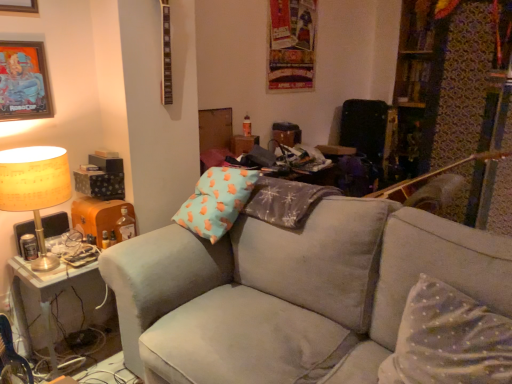
Question: From a real-world perspective, is metallic silver picture frame at upper left, which ranks as the second picture frame in top-to-bottom order, physically below white dotted fabric pillow at lower right?

Choices:
 (A) yes
 (B) no

Answer: (B)

Question: Is white dotted fabric pillow at lower right a part of metallic silver picture frame at upper left, which is the 1th picture frame in bottom-to-top order?

Choices:
 (A) yes
 (B) no

Answer: (B)

Question: Is metallic silver picture frame at upper left, which ranks as the second picture frame in top-to-bottom order, smaller than white dotted fabric pillow at lower right?

Choices:
 (A) yes
 (B) no

Answer: (A)

Question: Can we say metallic silver picture frame at upper left, which is the 1th picture frame in bottom-to-top order, lies outside white dotted fabric pillow at lower right?

Choices:
 (A) no
 (B) yes

Answer: (B)

Question: From a real-world perspective, does metallic silver picture frame at upper left, which ranks as the second picture frame in top-to-bottom order, stand above white dotted fabric pillow at lower right?

Choices:
 (A) yes
 (B) no

Answer: (A)

Question: Would you say suede gray couch at center is to the left or to the right of metallic silver picture frame at upper left, which ranks as the second picture frame in top-to-bottom order, in the picture?

Choices:
 (A) right
 (B) left

Answer: (A)

Question: Would you say suede gray couch at center is inside or outside metallic silver picture frame at upper left, which is the 1th picture frame in bottom-to-top order?

Choices:
 (A) inside
 (B) outside

Answer: (B)

Question: In terms of height, does suede gray couch at center look taller or shorter compared to metallic silver picture frame at upper left, which ranks as the second picture frame in top-to-bottom order?

Choices:
 (A) tall
 (B) short

Answer: (A)

Question: Is suede gray couch at center in front of or behind metallic silver picture frame at upper left, which ranks as the second picture frame in top-to-bottom order, in the image?

Choices:
 (A) behind
 (B) front

Answer: (B)

Question: From the image's perspective, relative to metallic picture frame at upper left, the 1th picture frame from the top, is white dotted fabric pillow at lower right above or below?

Choices:
 (A) above
 (B) below

Answer: (B)

Question: Visually, is white dotted fabric pillow at lower right positioned to the left or to the right of metallic picture frame at upper left, the 1th picture frame from the top?

Choices:
 (A) right
 (B) left

Answer: (A)

Question: Considering the positions of white dotted fabric pillow at lower right and metallic picture frame at upper left, arranged as the 2th picture frame when ordered from the bottom, in the image, is white dotted fabric pillow at lower right bigger or smaller than metallic picture frame at upper left, arranged as the 2th picture frame when ordered from the bottom,?

Choices:
 (A) big
 (B) small

Answer: (A)

Question: Is point (462, 311) closer or farther from the camera than point (9, 6)?

Choices:
 (A) farther
 (B) closer

Answer: (B)

Question: Is metallic picture frame at upper left, the 1th picture frame from the top, taller or shorter than suede gray couch at center?

Choices:
 (A) tall
 (B) short

Answer: (B)

Question: Is metallic picture frame at upper left, arranged as the 2th picture frame when ordered from the bottom, inside the boundaries of suede gray couch at center, or outside?

Choices:
 (A) outside
 (B) inside

Answer: (A)